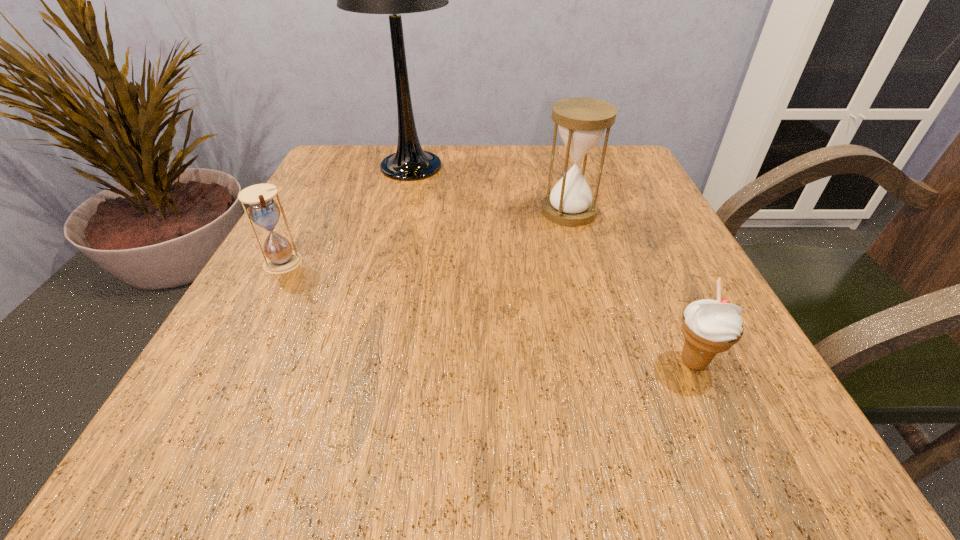
Find the location of a particular element. This screenshot has width=960, height=540. free spot between the second tallest object and the icecream is located at coordinates (631, 287).

Where is `vacant point located between the third tallest object and the second object from left to right`? The image size is (960, 540). vacant point located between the third tallest object and the second object from left to right is located at coordinates (347, 215).

The height and width of the screenshot is (540, 960). Find the location of `free space between the nearer hourglass and the third shortest object`. free space between the nearer hourglass and the third shortest object is located at coordinates (425, 238).

The height and width of the screenshot is (540, 960). What are the coordinates of `unoccupied area between the farthest object and the second shortest object` in the screenshot? It's located at (347, 215).

Select which object is the closest to the third object from left to right. Please provide its 2D coordinates. Your answer should be formatted as a tuple, i.e. [(x, y)], where the tuple contains the x and y coordinates of a point satisfying the conditions above.

[(410, 162)]

Point out which object is positioned as the second nearest to the nearest object. Please provide its 2D coordinates. Your answer should be formatted as a tuple, i.e. [(x, y)], where the tuple contains the x and y coordinates of a point satisfying the conditions above.

[(410, 162)]

Locate an element on the screen. The width and height of the screenshot is (960, 540). free space that satisfies the following two spatial constraints: 1. on the front side of the second object from left to right; 2. on the right side of the icecream is located at coordinates (362, 362).

In order to click on free location that satisfies the following two spatial constraints: 1. on the back side of the second object from left to right; 2. on the left side of the nearer hourglass in this screenshot , I will do `click(334, 166)`.

You are a GUI agent. You are given a task and a screenshot of the screen. Output one action in this format:
    pyautogui.click(x=<x>, y=<y>)
    Task: Click on the free spot that satisfies the following two spatial constraints: 1. on the back side of the table lamp; 2. on the right side of the nearer hourglass
    This screenshot has height=540, width=960.
    Given the screenshot: What is the action you would take?
    pyautogui.click(x=334, y=166)

I want to click on free region that satisfies the following two spatial constraints: 1. on the front side of the nearer hourglass; 2. on the right side of the shortest object, so click(229, 362).